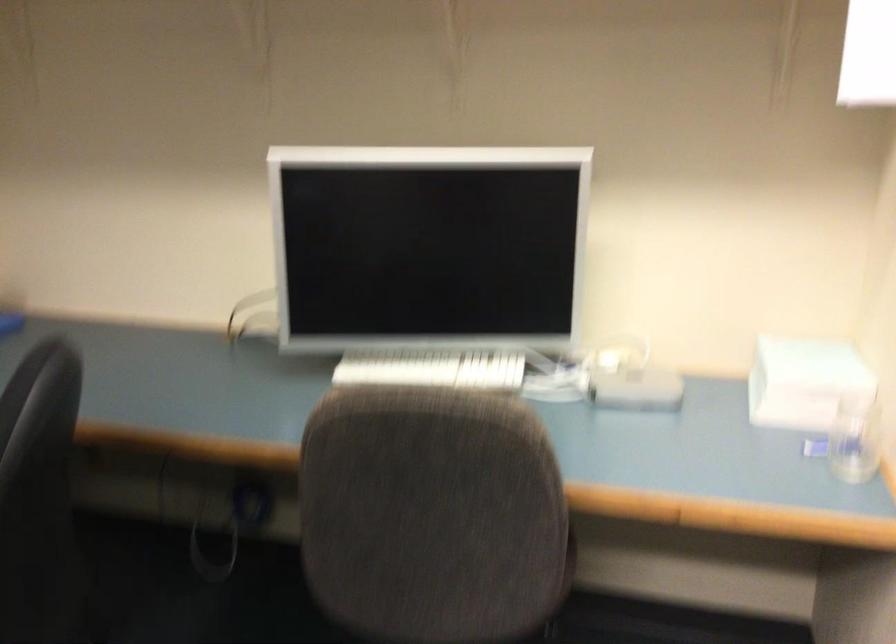
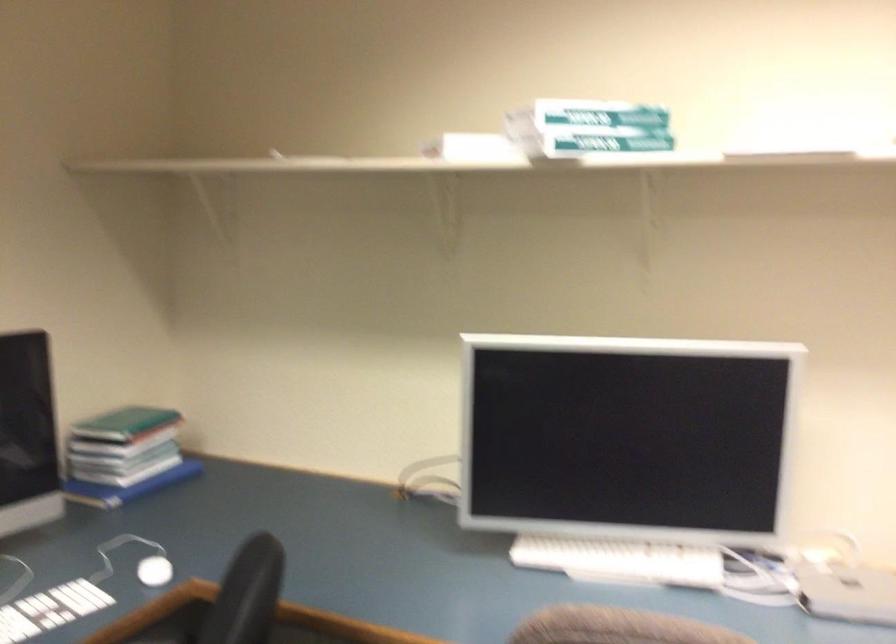
In a continuous first-person perspective shot, in which direction is the camera moving?

The cameraman walked toward left, forward.